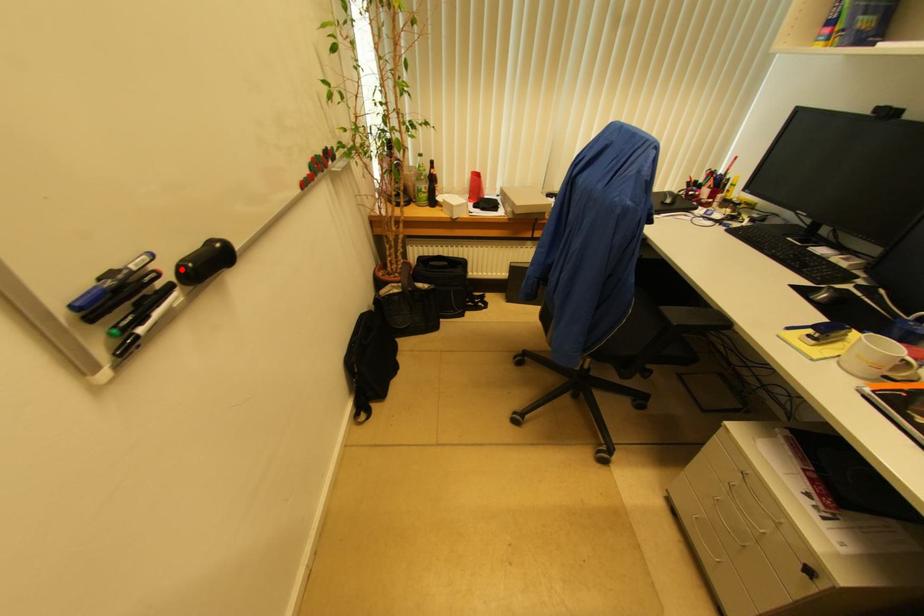
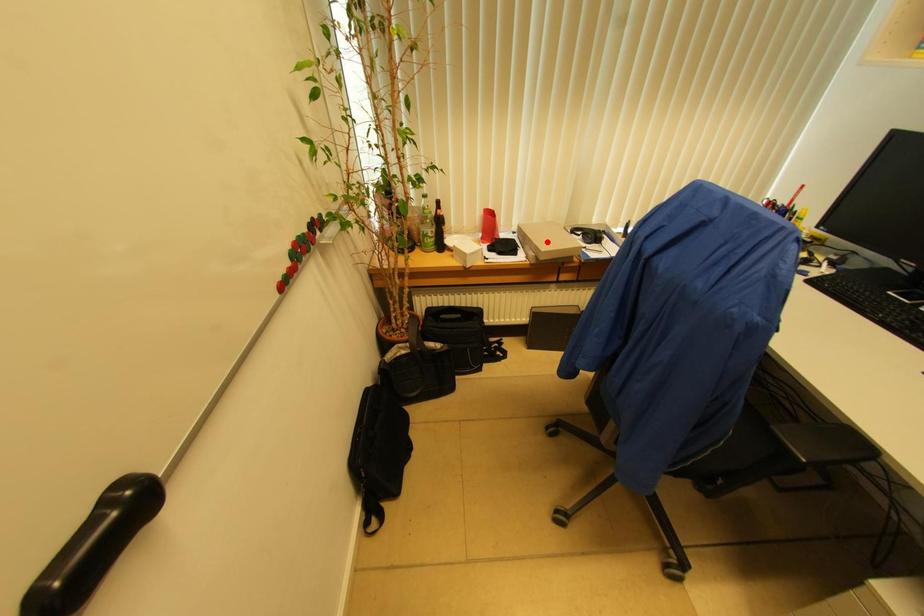
I am providing you with two images of the same scene from different viewpoints. A red point is marked on the first image and another point is marked on the second image. Is the marked point in image1 the same physical position as the marked point in image2?

No